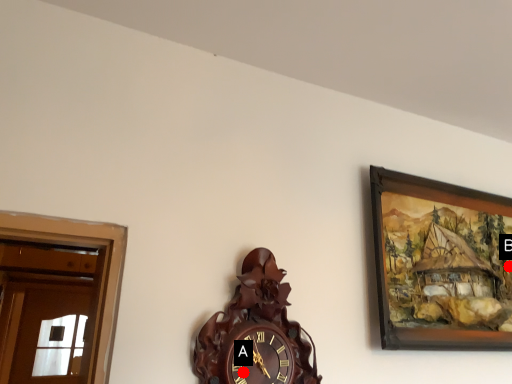
Question: Two points are circled on the image, labeled by A and B beside each circle. Which point is farther to the camera?

Choices:
 (A) A is further
 (B) B is further

Answer: (B)